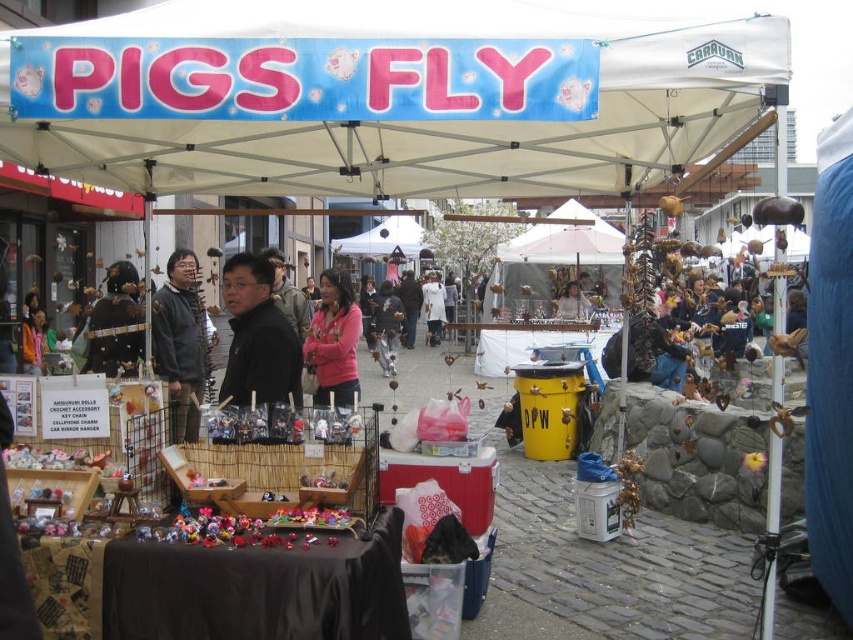
Is blue fabric canopy at upper center taller than pink fleece jacket at center?

No.

Is point (308, 93) positioned behind point (358, 317)?

That is False.

Image resolution: width=853 pixels, height=640 pixels. What do you see at coordinates (413, 108) in the screenshot?
I see `blue fabric canopy at upper center` at bounding box center [413, 108].

This screenshot has height=640, width=853. In order to click on blue fabric canopy at upper center in this screenshot , I will do `click(413, 108)`.

Can you confirm if white fabric umbrella at center is positioned above pink fleece jacket at center?

Yes, white fabric umbrella at center is above pink fleece jacket at center.

Who is higher up, white fabric umbrella at center or pink fleece jacket at center?

Positioned higher is white fabric umbrella at center.

Is point (488, 289) positioned in front of point (334, 371)?

No, it is not.

I want to click on white fabric umbrella at center, so click(553, 264).

Does point (254, 275) come farther from viewer compared to point (312, 349)?

No, (254, 275) is closer to viewer.

This screenshot has width=853, height=640. What do you see at coordinates (257, 337) in the screenshot?
I see `black matte jacket at center` at bounding box center [257, 337].

Is point (281, 333) less distant than point (320, 385)?

Yes, it is.

At what (x,y) coordinates should I click in order to perform the action: click on black matte jacket at center. Please return your answer as a coordinate pair (x, y). The image size is (853, 640). Looking at the image, I should click on (257, 337).